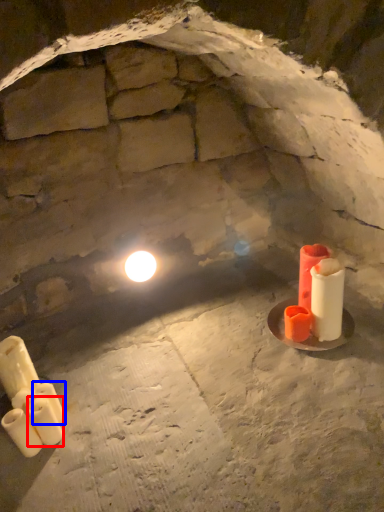
Question: Among these objects, which one is nearest to the camera, candle (highlighted by a red box) or candle (highlighted by a blue box)?

Choices:
 (A) candle
 (B) candle

Answer: (A)